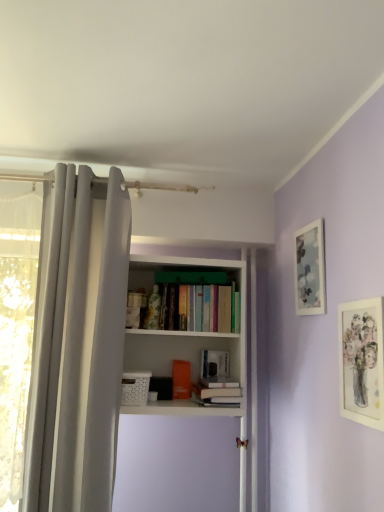
Question: Is white fabric curtain at left positioned in front of hardcover book at center, which appears as the second book when viewed from the back?

Choices:
 (A) no
 (B) yes

Answer: (B)

Question: Can you confirm if white fabric curtain at left is positioned to the left of hardcover book at center, the first book viewed from the front?

Choices:
 (A) no
 (B) yes

Answer: (B)

Question: From the image's perspective, is white fabric curtain at left on top of hardcover book at center, which appears as the second book when viewed from the back?

Choices:
 (A) no
 (B) yes

Answer: (B)

Question: Is white fabric curtain at left touching hardcover book at center, the first book viewed from the front?

Choices:
 (A) no
 (B) yes

Answer: (A)

Question: Is white fabric curtain at left surrounding hardcover book at center, the first book viewed from the front?

Choices:
 (A) no
 (B) yes

Answer: (A)

Question: Considering the relative sizes of white fabric curtain at left and hardcover book at center, which appears as the second book when viewed from the back, in the image provided, is white fabric curtain at left wider than hardcover book at center, which appears as the second book when viewed from the back,?

Choices:
 (A) no
 (B) yes

Answer: (A)

Question: From a real-world perspective, is hardcover book at center, which appears as the second book when viewed from the back, positioned over matte glass picture frame at upper right, the first picture frame when ordered from back to front, based on gravity?

Choices:
 (A) no
 (B) yes

Answer: (A)

Question: Considering the relative positions of hardcover book at center, the first book viewed from the front, and matte glass picture frame at upper right, the first picture frame when ordered from back to front, in the image provided, is hardcover book at center, the first book viewed from the front, to the left of matte glass picture frame at upper right, the first picture frame when ordered from back to front, from the viewer's perspective?

Choices:
 (A) no
 (B) yes

Answer: (B)

Question: From the image's perspective, would you say hardcover book at center, which appears as the second book when viewed from the back, is positioned over matte glass picture frame at upper right, the first picture frame when ordered from back to front?

Choices:
 (A) yes
 (B) no

Answer: (B)

Question: Is hardcover book at center, which appears as the second book when viewed from the back, bigger than matte glass picture frame at upper right, arranged as the second picture frame when viewed from the front?

Choices:
 (A) yes
 (B) no

Answer: (A)

Question: From the image's perspective, does hardcover book at center, the first book viewed from the front, appear lower than matte glass picture frame at upper right, arranged as the second picture frame when viewed from the front?

Choices:
 (A) yes
 (B) no

Answer: (A)

Question: Is hardcover book at center, which appears as the second book when viewed from the back, taller than matte glass picture frame at upper right, arranged as the second picture frame when viewed from the front?

Choices:
 (A) yes
 (B) no

Answer: (B)

Question: From the image's perspective, is white fabric curtain at left above matte glass picture frame at upper right, the first picture frame when ordered from back to front?

Choices:
 (A) yes
 (B) no

Answer: (B)